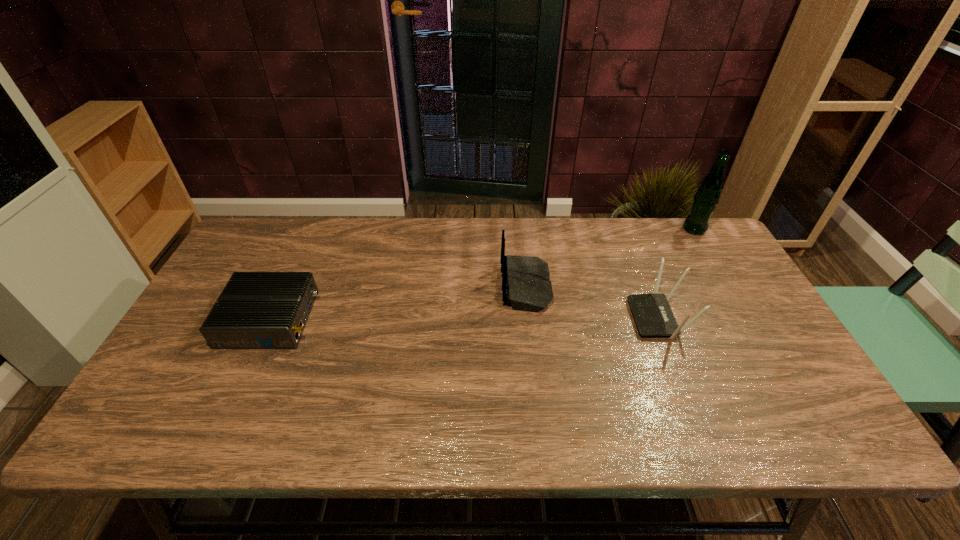
Image resolution: width=960 pixels, height=540 pixels. Find the location of `the rightmost object`. the rightmost object is located at coordinates (707, 196).

The image size is (960, 540). I want to click on the farthest object, so [707, 196].

Find the location of a particular element. the second object from left to right is located at coordinates (526, 286).

Where is `the third object from left to right`? the third object from left to right is located at coordinates (653, 316).

This screenshot has height=540, width=960. Find the location of `the rightmost router`. the rightmost router is located at coordinates (653, 316).

What are the coordinates of `the leftmost router` in the screenshot? It's located at (256, 310).

The width and height of the screenshot is (960, 540). In order to click on the shortest object in this screenshot , I will do `click(256, 310)`.

Image resolution: width=960 pixels, height=540 pixels. Identify the location of free region located 0.390m on the left of the rightmost object. (568, 229).

This screenshot has width=960, height=540. In order to click on free spot located on the back of the second object from left to right in this screenshot , I will do `click(372, 287)`.

Image resolution: width=960 pixels, height=540 pixels. I want to click on vacant region located on the back of the second object from left to right, so click(x=450, y=287).